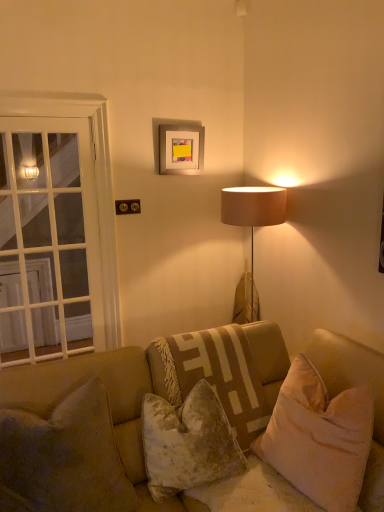
Question: From a real-world perspective, is velvet beige pillow at center, which appears as the 2th pillow when viewed from the left, physically below velvet beige couch at center?

Choices:
 (A) yes
 (B) no

Answer: (B)

Question: Would you say velvet beige couch at center is part of velvet beige pillow at center, which appears as the 2th pillow when viewed from the left,'s contents?

Choices:
 (A) yes
 (B) no

Answer: (B)

Question: Considering the relative sizes of velvet beige pillow at center, which appears as the 2th pillow when viewed from the left, and velvet beige couch at center in the image provided, is velvet beige pillow at center, which appears as the 2th pillow when viewed from the left, bigger than velvet beige couch at center?

Choices:
 (A) no
 (B) yes

Answer: (A)

Question: Would you consider velvet beige pillow at center, which is the third pillow in right-to-left order, to be distant from velvet beige couch at center?

Choices:
 (A) yes
 (B) no

Answer: (B)

Question: Can you confirm if velvet beige pillow at center, which appears as the 2th pillow when viewed from the left, is thinner than velvet beige couch at center?

Choices:
 (A) yes
 (B) no

Answer: (A)

Question: In the image, is white glass door at left positioned in front of or behind silver metallic picture frame at upper center?

Choices:
 (A) behind
 (B) front

Answer: (B)

Question: Is white glass door at left taller or shorter than silver metallic picture frame at upper center?

Choices:
 (A) tall
 (B) short

Answer: (A)

Question: From the image's perspective, is white glass door at left located above or below silver metallic picture frame at upper center?

Choices:
 (A) below
 (B) above

Answer: (A)

Question: From a real-world perspective, is white glass door at left positioned above or below silver metallic picture frame at upper center?

Choices:
 (A) above
 (B) below

Answer: (B)

Question: Is point (200, 158) closer or farther from the camera than point (317, 377)?

Choices:
 (A) farther
 (B) closer

Answer: (A)

Question: From a real-world perspective, relative to velvet beige pillow at lower right, the first pillow in the right-to-left sequence, is silver metallic picture frame at upper center vertically above or below?

Choices:
 (A) below
 (B) above

Answer: (B)

Question: Is silver metallic picture frame at upper center situated inside velvet beige pillow at lower right, the first pillow in the right-to-left sequence, or outside?

Choices:
 (A) inside
 (B) outside

Answer: (B)

Question: Considering the positions of silver metallic picture frame at upper center and velvet beige pillow at lower right, the first pillow in the right-to-left sequence, in the image, is silver metallic picture frame at upper center taller or shorter than velvet beige pillow at lower right, the first pillow in the right-to-left sequence,?

Choices:
 (A) tall
 (B) short

Answer: (B)

Question: From a real-world perspective, relative to velvety beige pillow at lower left, the 1th pillow viewed from the left, is velvet beige pillow at center, marked as the third pillow in a left-to-right arrangement, vertically above or below?

Choices:
 (A) below
 (B) above

Answer: (A)

Question: Choose the correct answer: Is velvet beige pillow at center, which is the second pillow in right-to-left order, inside velvety beige pillow at lower left, the 1th pillow viewed from the left, or outside it?

Choices:
 (A) inside
 (B) outside

Answer: (B)